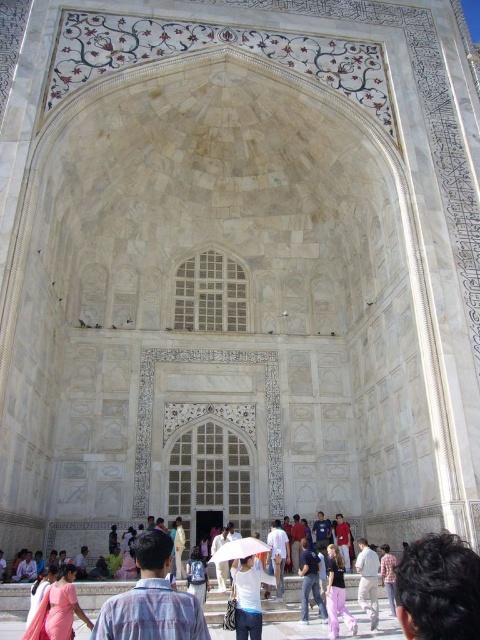
Between white matte shirt at center and white cotton shirt at center, which one has more height?

With more height is white matte shirt at center.

Can you confirm if white matte shirt at center is positioned to the right of white cotton shirt at center?

Correct, you'll find white matte shirt at center to the right of white cotton shirt at center.

Find the location of `white matte shirt at center`. white matte shirt at center is located at coordinates (248, 596).

You are a GUI agent. You are given a task and a screenshot of the screen. Output one action in this format:
    pyautogui.click(x=<x>, y=<y>)
    Task: Click on the white matte shirt at center
    Image resolution: width=480 pixels, height=640 pixels.
    Given the screenshot: What is the action you would take?
    pyautogui.click(x=248, y=596)

How far apart are pink fabric pants at lower center and white cotton shirt at center?

They are 9.25 meters apart.

Is point (336, 596) in front of point (191, 563)?

Yes, it is.

Where is `pink fabric pants at lower center`? pink fabric pants at lower center is located at coordinates 336,595.

Which is behind, point (477, 595) or point (248, 614)?

Point (248, 614)

I want to click on dark brown hair at lower right, so click(x=439, y=588).

I want to click on dark brown hair at lower right, so click(x=439, y=588).